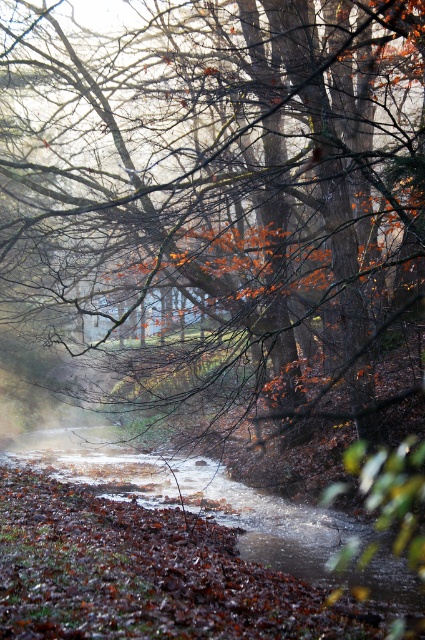
Question: Which object is closer to the camera taking this photo?

Choices:
 (A) brown matte tree at center
 (B) brown leafy stream at center

Answer: (A)

Question: Is brown matte tree at center thinner than brown leafy stream at center?

Choices:
 (A) yes
 (B) no

Answer: (B)

Question: Which of the following is the farthest from the observer?

Choices:
 (A) brown matte tree at center
 (B) brown leafy stream at center

Answer: (B)

Question: Is brown matte tree at center to the right of brown leafy stream at center from the viewer's perspective?

Choices:
 (A) yes
 (B) no

Answer: (A)

Question: Is brown matte tree at center smaller than brown leafy stream at center?

Choices:
 (A) no
 (B) yes

Answer: (A)